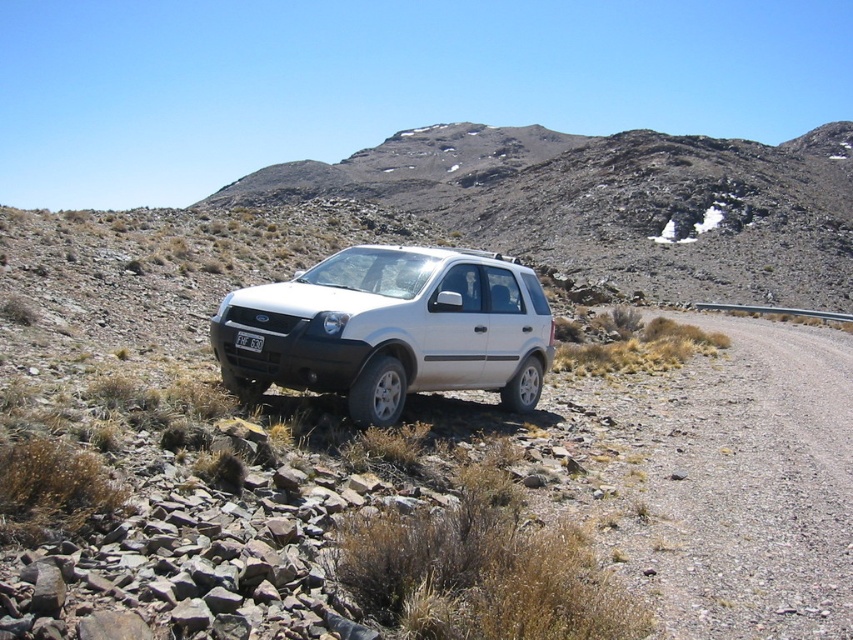
Can you confirm if gray gravel road at right is shorter than white matte suv at center?

Correct, gray gravel road at right is not as tall as white matte suv at center.

Is gray gravel road at right to the right of white matte suv at center from the viewer's perspective?

Correct, you'll find gray gravel road at right to the right of white matte suv at center.

Locate an element on the screen. The height and width of the screenshot is (640, 853). gray gravel road at right is located at coordinates (753, 484).

Is gray gravel road at right wider than white plastic license plate at center?

Yes.

Identify the location of gray gravel road at right. This screenshot has height=640, width=853. (753, 484).

This screenshot has width=853, height=640. In order to click on gray gravel road at right in this screenshot , I will do `click(753, 484)`.

Does white matte suv at center appear on the right side of white plastic license plate at center?

Correct, you'll find white matte suv at center to the right of white plastic license plate at center.

Is white matte suv at center below white plastic license plate at center?

Incorrect, white matte suv at center is not positioned below white plastic license plate at center.

Image resolution: width=853 pixels, height=640 pixels. Describe the element at coordinates (392, 330) in the screenshot. I see `white matte suv at center` at that location.

Where is `white matte suv at center`? This screenshot has width=853, height=640. white matte suv at center is located at coordinates (392, 330).